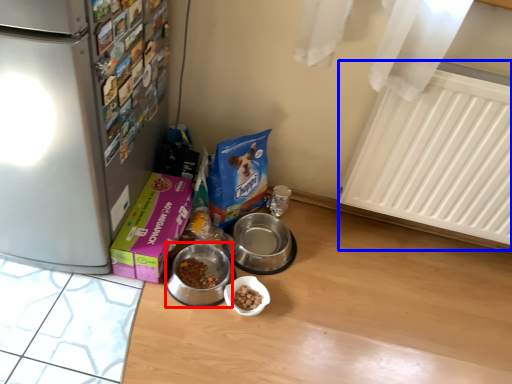
Question: Among these objects, which one is farthest to the camera, appliance (highlighted by a red box) or radiator (highlighted by a blue box)?

Choices:
 (A) appliance
 (B) radiator

Answer: (A)